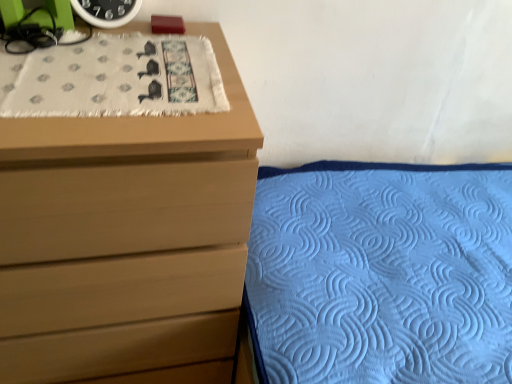
Where is `vacant area located to the right-hand side of green matte clock at upper left`? This screenshot has width=512, height=384. vacant area located to the right-hand side of green matte clock at upper left is located at coordinates (166, 45).